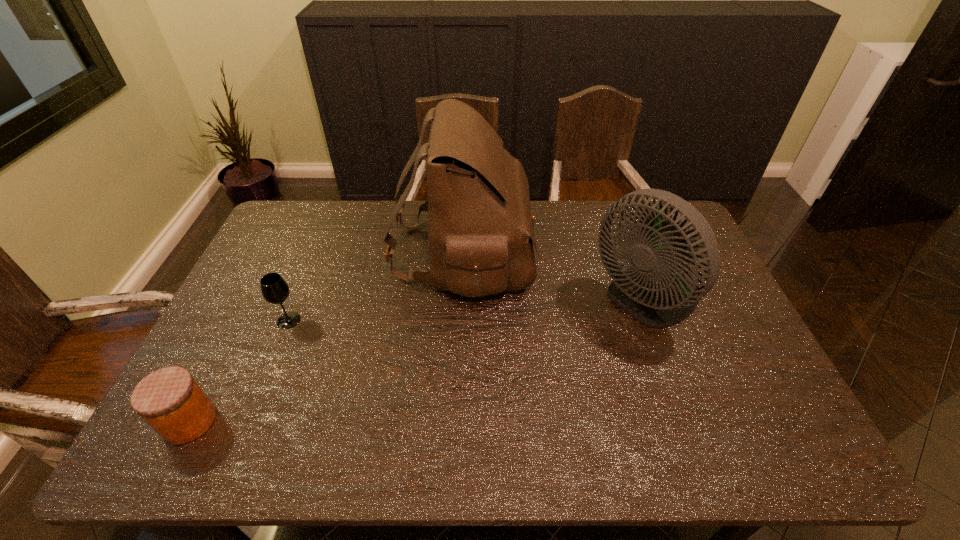
Locate an element on the screen. free point located 0.340m in front of the rightmost object to direct airflow is located at coordinates tap(477, 302).

This screenshot has width=960, height=540. What are the coordinates of `vacant space located on the back of the wineglass` in the screenshot? It's located at (316, 254).

Identify the location of vacant position located on the right of the shortest object. (374, 421).

In order to click on object positioned at the far edge in this screenshot , I will do click(480, 227).

I want to click on object present at the near edge, so click(169, 399).

Where is `wineglass that is at the left edge`? wineglass that is at the left edge is located at coordinates (274, 289).

I want to click on jar that is positioned at the left edge, so click(x=169, y=399).

This screenshot has width=960, height=540. I want to click on object situated at the right edge, so click(x=651, y=290).

Identify the location of object located at the near left corner. The width and height of the screenshot is (960, 540). (169, 399).

I want to click on vacant position at the far edge of the desktop, so click(x=565, y=211).